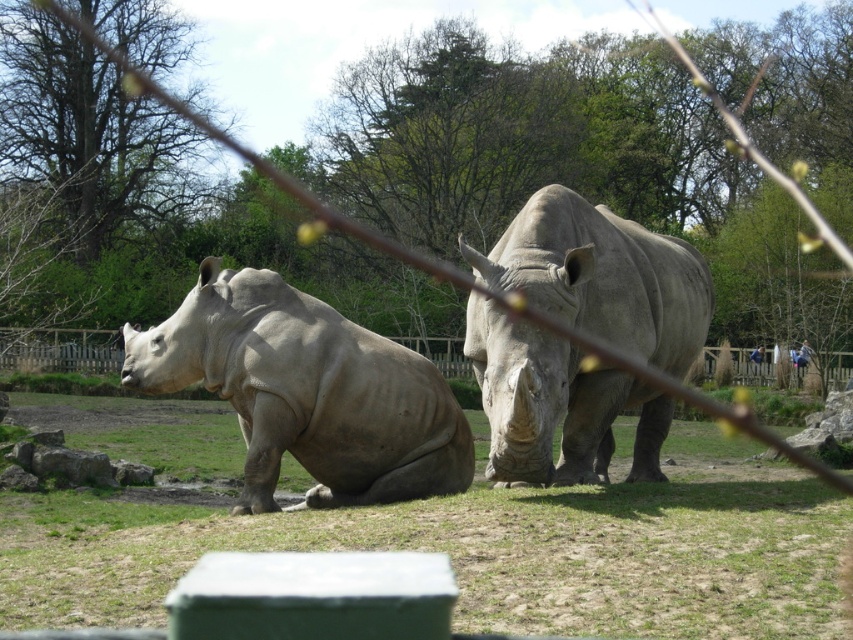
Question: Which point is closer to the camera?

Choices:
 (A) matte gray rhinoceros at left
 (B) green grass at center
 (C) gray matte rhinoceros at center

Answer: (B)

Question: Is green grass at center in front of matte gray rhinoceros at left?

Choices:
 (A) yes
 (B) no

Answer: (A)

Question: Which of the following is the farthest from the observer?

Choices:
 (A) gray matte rhinoceros at center
 (B) matte gray rhinoceros at left

Answer: (A)

Question: From the image, what is the correct spatial relationship of matte gray rhinoceros at left in relation to gray matte rhinoceros at center?

Choices:
 (A) below
 (B) above

Answer: (B)

Question: Can you confirm if green grass at center is thinner than matte gray rhinoceros at left?

Choices:
 (A) yes
 (B) no

Answer: (B)

Question: Among these points, which one is nearest to the camera?

Choices:
 (A) (294, 326)
 (B) (521, 330)
 (C) (99, 552)

Answer: (C)